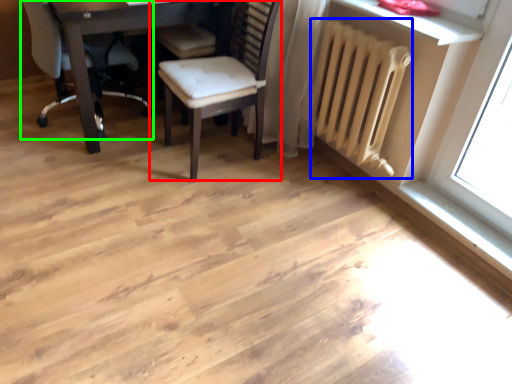
Question: Which object is positioned farthest from chair (highlighted by a red box)? Select from radiator (highlighted by a blue box) and chair (highlighted by a green box).

Choices:
 (A) radiator
 (B) chair

Answer: (B)